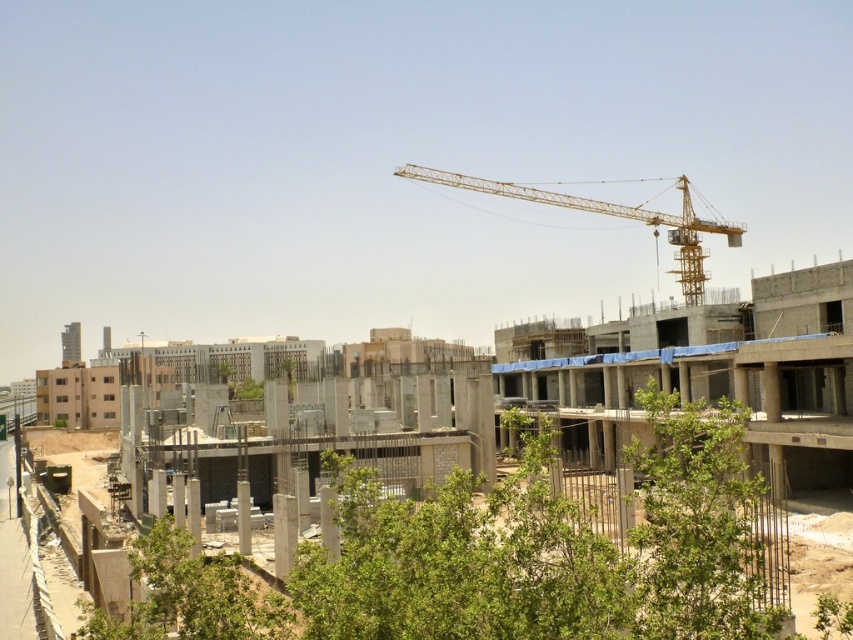
Does concrete at center appear over yellow metallic crane at upper center?

No.

Find the location of `concrete at center`. concrete at center is located at coordinates (809, 442).